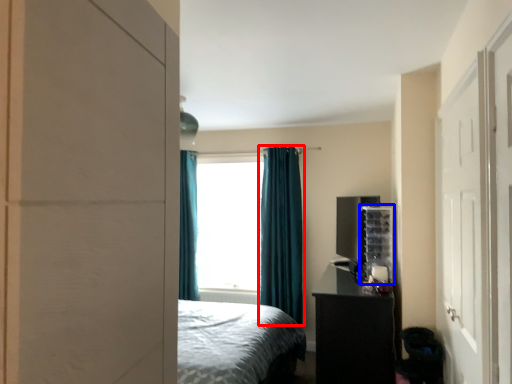
Question: Which object is further to the camera taking this photo, curtain (highlighted by a red box) or shelf (highlighted by a blue box)?

Choices:
 (A) curtain
 (B) shelf

Answer: (A)